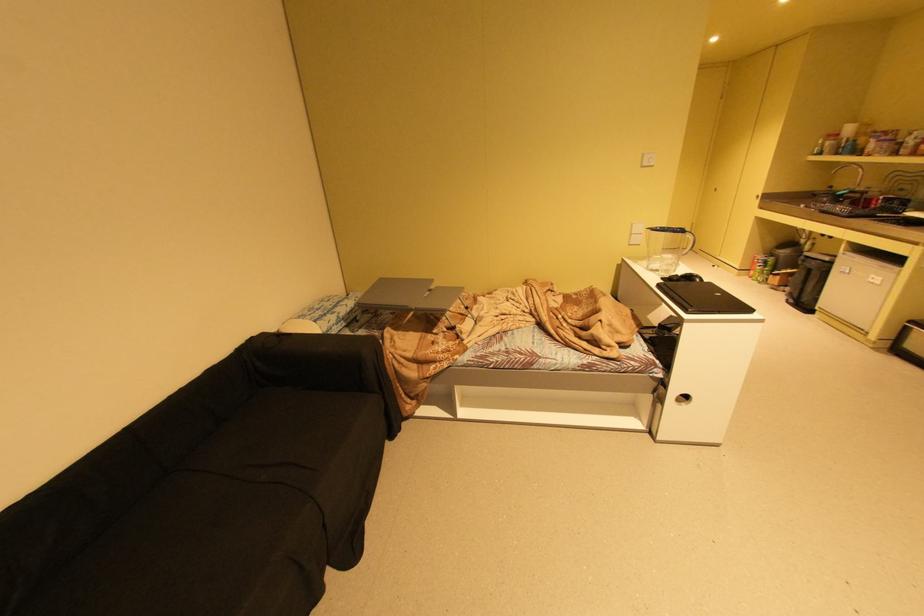
The width and height of the screenshot is (924, 616). Describe the element at coordinates (684, 399) in the screenshot. I see `the cabinet handle hole` at that location.